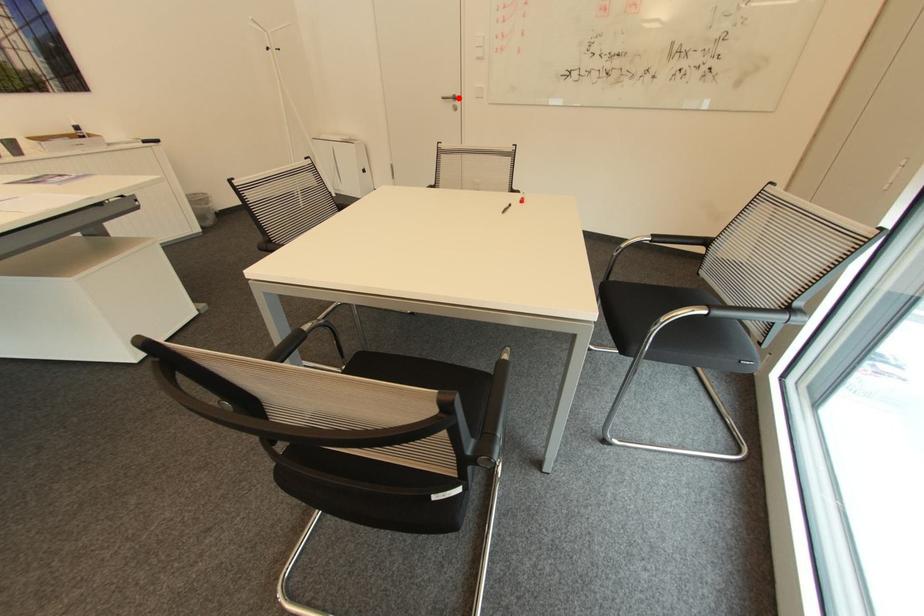
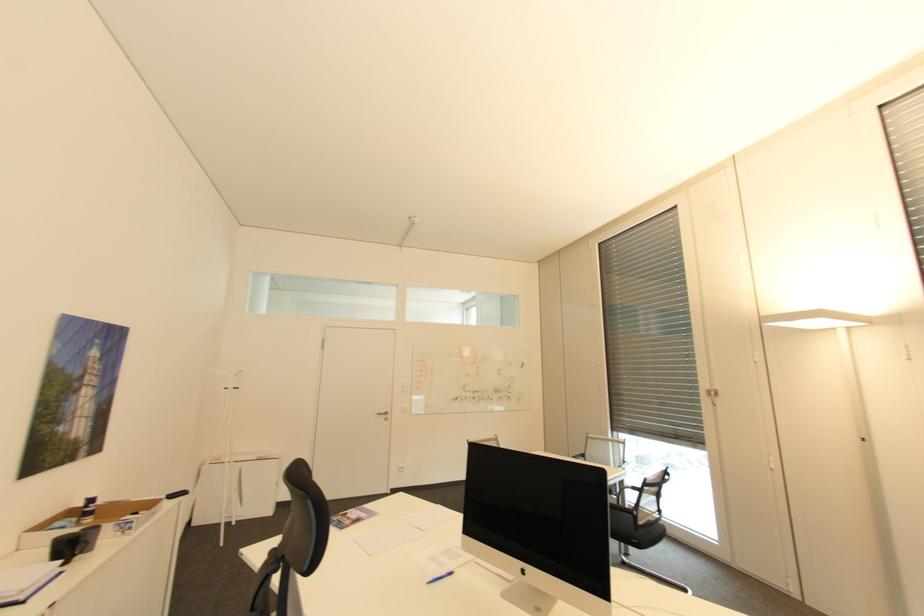
Where in the second image is the point corresponding to the highlighted location from the first image?

(391, 413)